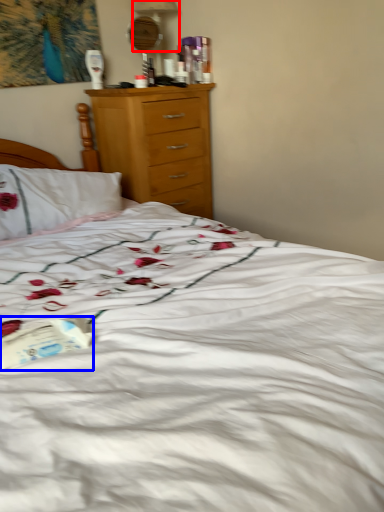
Question: Which object appears farthest to the camera in this image, table lamp (highlighted by a red box) or paperback book (highlighted by a blue box)?

Choices:
 (A) table lamp
 (B) paperback book

Answer: (A)